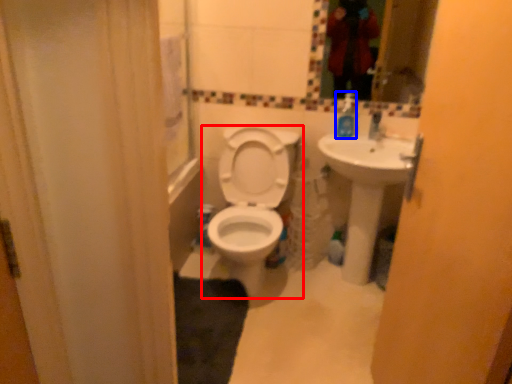
Question: Which point is closer to the camera, toilet (highlighted by a red box) or soap dispenser (highlighted by a blue box)?

Choices:
 (A) toilet
 (B) soap dispenser

Answer: (A)